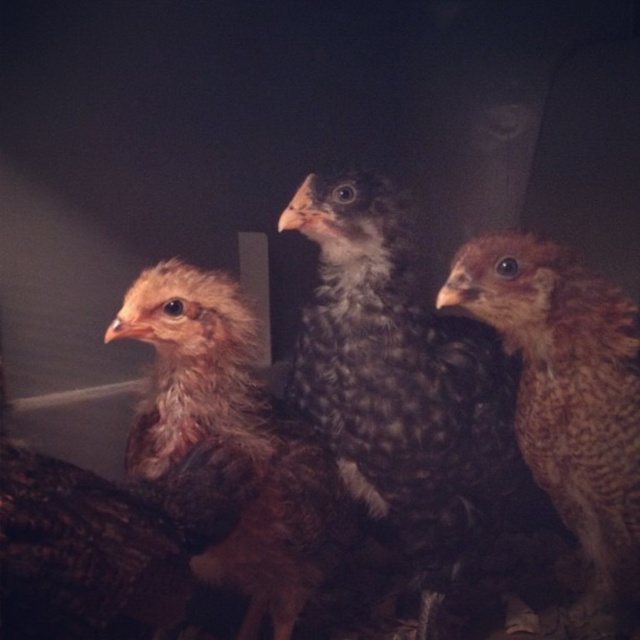
Question: Which point is farther to the camera?

Choices:
 (A) (230, 339)
 (B) (484, 513)

Answer: (B)

Question: Is dark speckled feathers at center above brown speckled chicken at right?

Choices:
 (A) yes
 (B) no

Answer: (A)

Question: Is dark speckled feathers at center in front of brown speckled chicken at right?

Choices:
 (A) yes
 (B) no

Answer: (B)

Question: Is dark speckled feathers at center thinner than brown speckled feathers at center?

Choices:
 (A) yes
 (B) no

Answer: (B)

Question: Among these objects, which one is nearest to the camera?

Choices:
 (A) brown speckled feathers at center
 (B) dark speckled feathers at center
 (C) brown speckled chicken at right

Answer: (A)

Question: Which point is closer to the camera?

Choices:
 (A) brown speckled feathers at center
 (B) brown speckled chicken at right

Answer: (A)